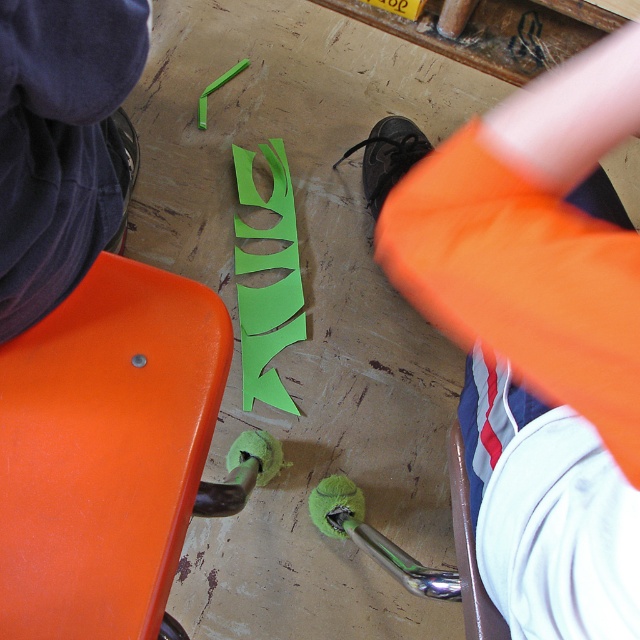
Question: Which of the following is the farthest from the observer?

Choices:
 (A) orange fabric pants at lower right
 (B) dark blue fabric at upper left
 (C) white fabric at lower right
 (D) orange matte/stained stool at lower left

Answer: (C)

Question: Is green paper cutout at center wider than white fabric at lower right?

Choices:
 (A) no
 (B) yes

Answer: (B)

Question: Which point appears farthest from the camera in this image?

Choices:
 (A) (140, 452)
 (B) (486, 620)
 (C) (634, 458)

Answer: (A)

Question: Can you confirm if orange matte/stained stool at lower left is wider than dark blue fabric at upper left?

Choices:
 (A) yes
 (B) no

Answer: (A)

Question: Which object is the closest to the orange matte/stained stool at lower left?

Choices:
 (A) green paper cutout at center
 (B) white fabric at lower right

Answer: (B)

Question: Can you confirm if orange fabric pants at lower right is bigger than green paper cutout at center?

Choices:
 (A) no
 (B) yes

Answer: (B)